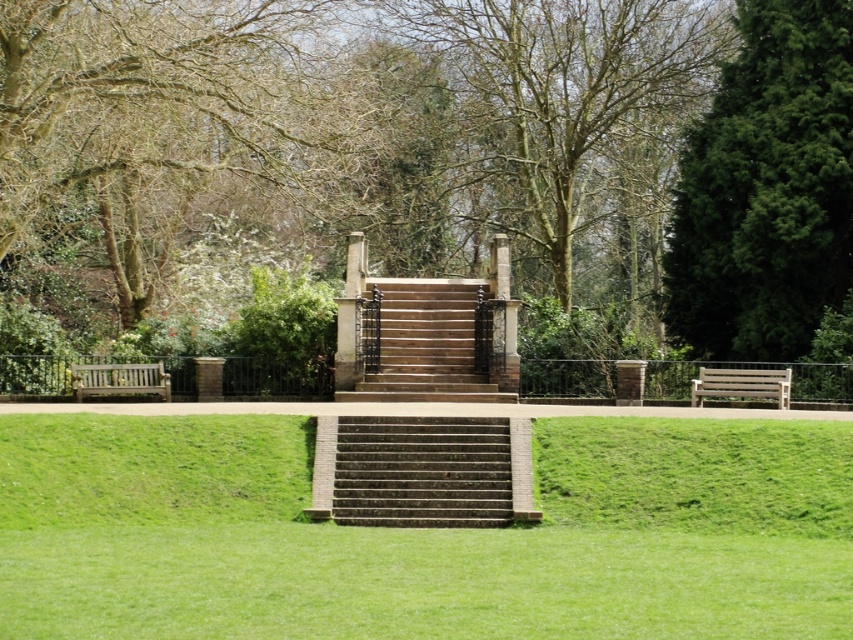
Question: Does dark brown stone stairs at center have a lesser width compared to wooden park bench at left?

Choices:
 (A) yes
 (B) no

Answer: (B)

Question: Based on their relative distances, which object is farther from the brown stone stairs at center?

Choices:
 (A) green textured tree at right
 (B) wooden bench at right

Answer: (A)

Question: Among these objects, which one is farthest from the camera?

Choices:
 (A) green textured tree at right
 (B) wooden bench at right
 (C) brown stone stairs at center

Answer: (A)

Question: Does dark brown stone stairs at center have a greater width compared to wooden park bench at left?

Choices:
 (A) yes
 (B) no

Answer: (A)

Question: Which object is farther from the camera taking this photo?

Choices:
 (A) green textured tree at right
 (B) wooden park bench at left
 (C) dark brown stone stairs at center

Answer: (A)

Question: From the image, what is the correct spatial relationship of dark brown stone stairs at center in relation to wooden bench at right?

Choices:
 (A) left
 (B) right

Answer: (A)